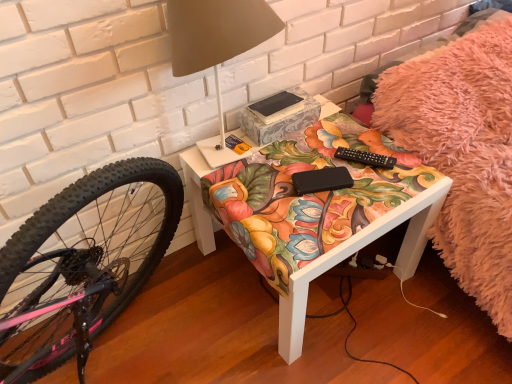
This screenshot has height=384, width=512. Find the location of `vacant space situated on the left part of matte floral-patterned table at center`. vacant space situated on the left part of matte floral-patterned table at center is located at coordinates (177, 315).